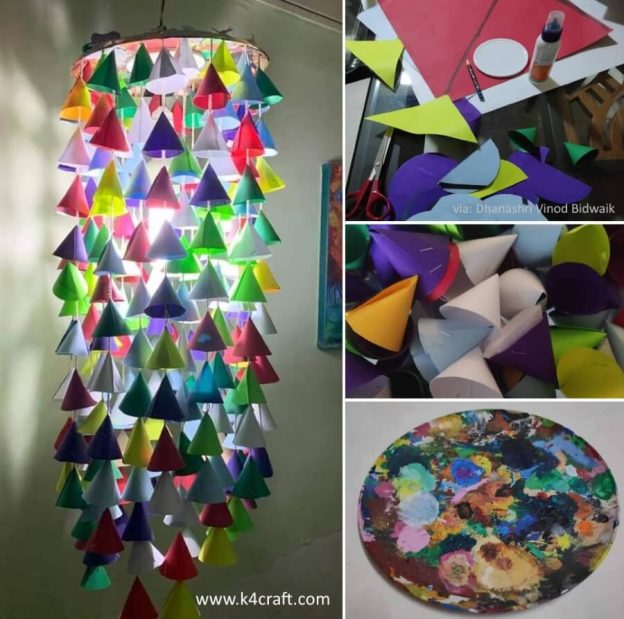
Locate an element on the screen. lampshade is located at coordinates (170, 31).